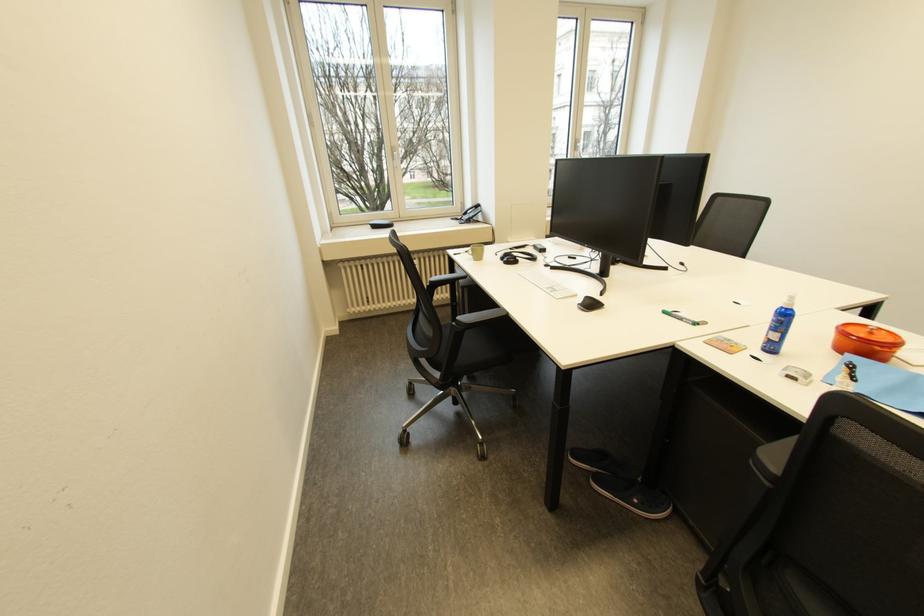
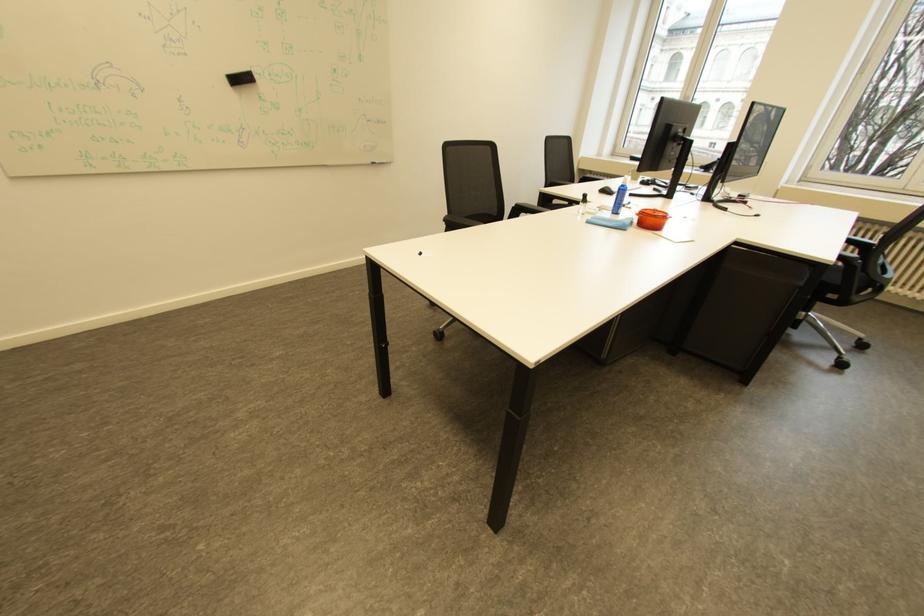
Find the pixel in the second image that matches (x=881, y=334) in the first image.

(664, 213)